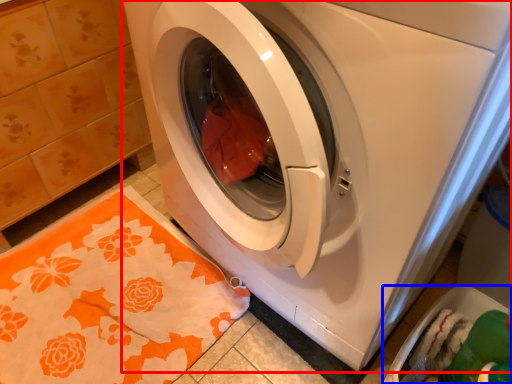
Question: Which object appears farthest to the camera in this image, washing machine (highlighted by a red box) or dish washer (highlighted by a blue box)?

Choices:
 (A) washing machine
 (B) dish washer

Answer: (B)